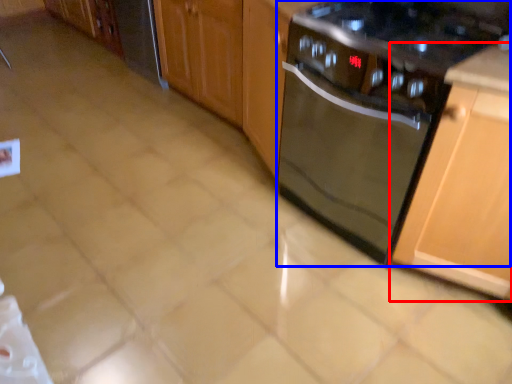
Question: Which point is closer to the camera, cabinetry (highlighted by a red box) or kitchen appliance (highlighted by a blue box)?

Choices:
 (A) cabinetry
 (B) kitchen appliance

Answer: (A)